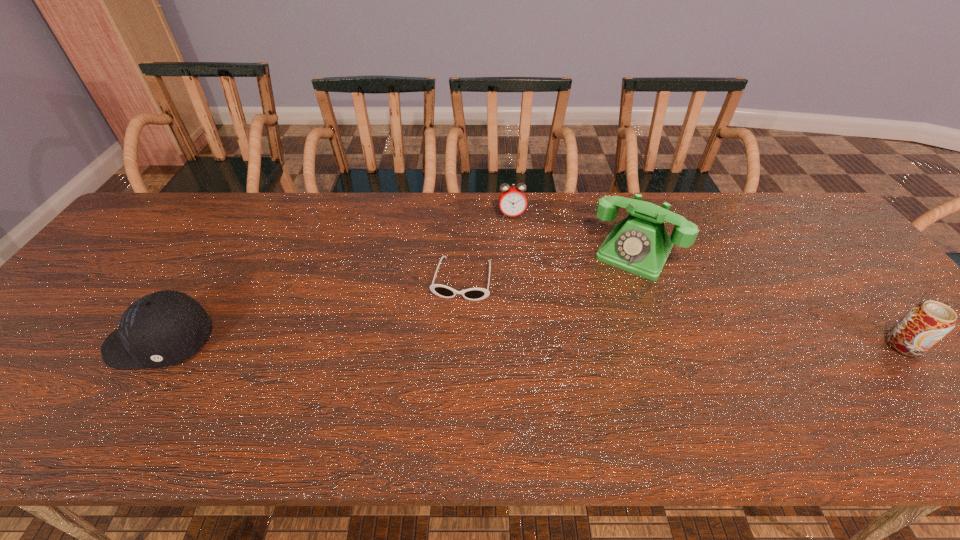
The height and width of the screenshot is (540, 960). In order to click on vacant space located 0.380m on the dial of the telephone in this screenshot , I will do `click(563, 380)`.

This screenshot has width=960, height=540. What are the coordinates of `alarm clock situated at the far edge` in the screenshot? It's located at (512, 200).

Identify the location of telephone positioned at the far edge. Image resolution: width=960 pixels, height=540 pixels. (640, 244).

You are a GUI agent. You are given a task and a screenshot of the screen. Output one action in this format:
    pyautogui.click(x=<x>, y=<y>)
    Task: Click on the object located at the near edge
    The height and width of the screenshot is (540, 960).
    Given the screenshot: What is the action you would take?
    pyautogui.click(x=161, y=329)

The height and width of the screenshot is (540, 960). In order to click on object located in the right edge section of the desktop in this screenshot , I will do `click(926, 323)`.

In the image, there is a desktop. Where is `vacant space at the far edge`? vacant space at the far edge is located at coordinates [721, 212].

In the image, there is a desktop. Where is `vacant region at the near edge`? The width and height of the screenshot is (960, 540). vacant region at the near edge is located at coordinates [135, 397].

You are a GUI agent. You are given a task and a screenshot of the screen. Output one action in this format:
    pyautogui.click(x=<x>, y=<y>)
    Task: Click on the free space at the far left corner
    
    Given the screenshot: What is the action you would take?
    pyautogui.click(x=183, y=199)

In the image, there is a desktop. Where is `vacant space at the far right corner`? The image size is (960, 540). vacant space at the far right corner is located at coordinates (780, 196).

This screenshot has height=540, width=960. What are the coordinates of `empty space that is in between the tallest object and the alarm clock` in the screenshot? It's located at (573, 234).